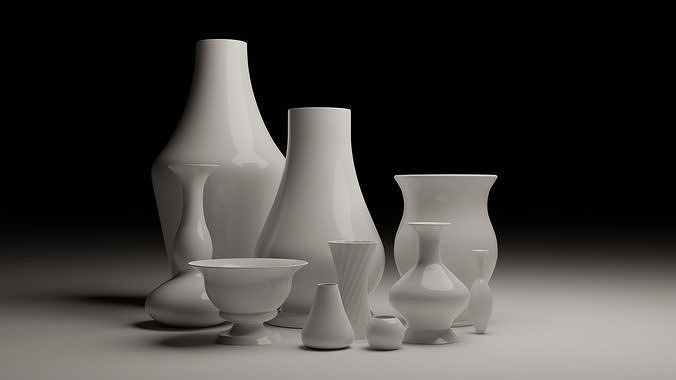
The width and height of the screenshot is (676, 380). In order to click on 3 medium size vases in this screenshot , I will do `click(195, 223)`, `click(243, 298)`, `click(462, 201)`.